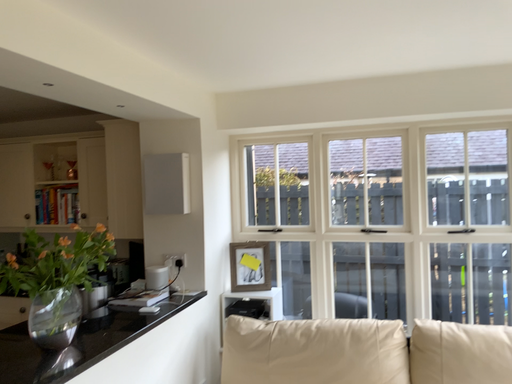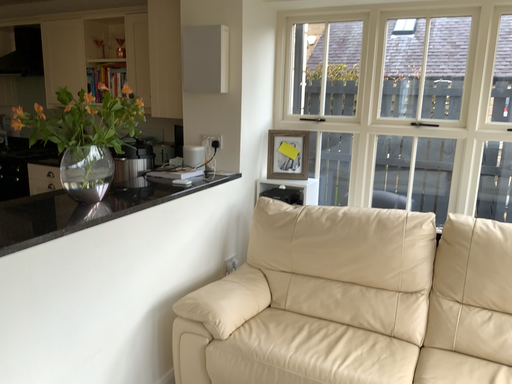
Question: Which way did the camera rotate in the video?

Choices:
 (A) rotated left
 (B) rotated right

Answer: (A)